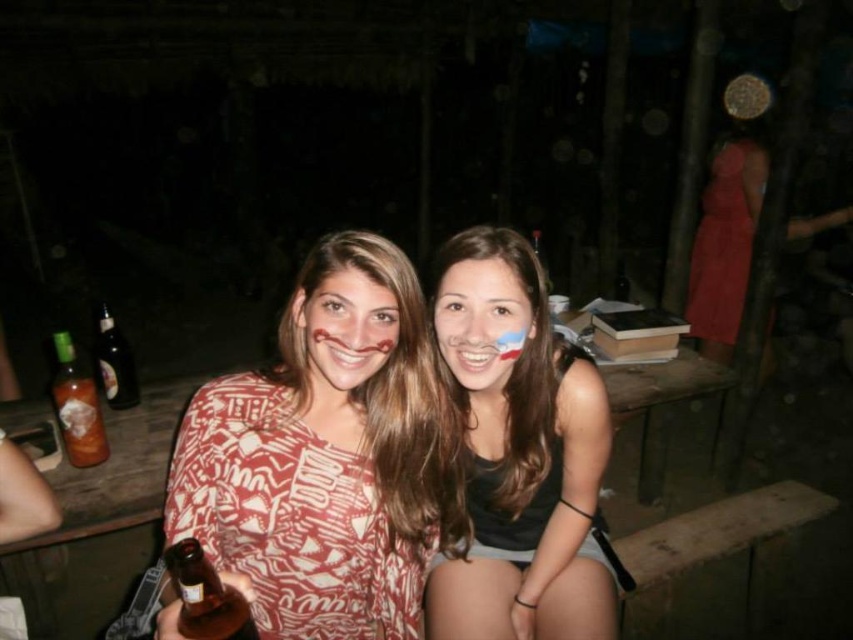
You are a photographer adjusting the focus on your camera. You want to ensure that both the matte black tank top at center and the matte skin face at center are in sharp focus. Given that your camera can only maintain focus within a 15 cm range, will both objects remain in focus?

The matte black tank top at center is 14.82 centimeters from the matte skin face at center, which is within the 15 cm focus range. Therefore, both objects will remain in focus.

You are at a nighttime gathering and see two bottles. The brown glass bottle at lower left and the dark glass bottle at left. Which bottle is located lower in the image?

The brown glass bottle at lower left is positioned under the dark glass bottle at left, so it is located lower in the image.

You are at a party and see two bottles, a brown glass bottle at lower left and a dark glass bottle at left. Which one is more to the left?

The dark glass bottle at left is more to the left because the brown glass bottle at lower left is positioned on the right side of it.